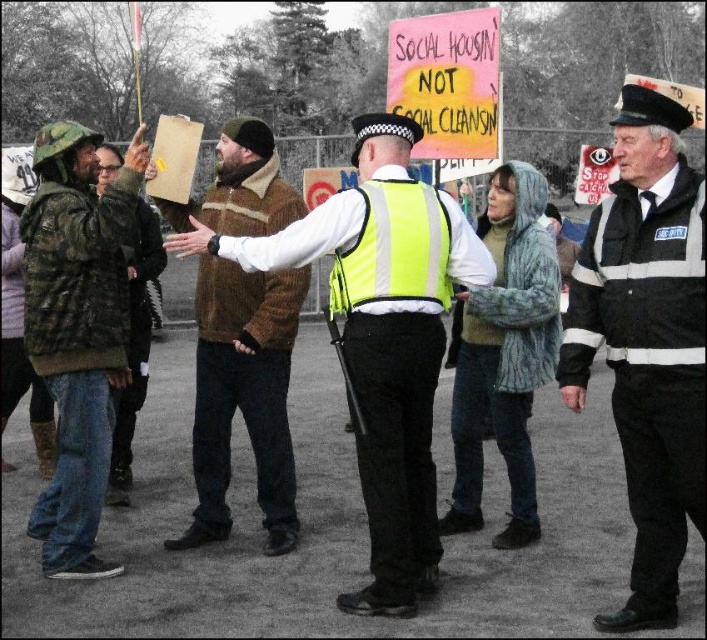
You are a photographer standing near the camera. You want to take a photo of the black uniform at center from a distance that ensures the subject fills the frame without being too close. Given that the recommended minimum distance for such shots is 3 meters, can you take the photo from your current position?

The black uniform at center and camera are 3.64 meters apart. Since the minimum recommended distance is 3 meters, you can take the photo from your current position as the distance is sufficient.

You are a photographer trying to capture a clear shot of both the camouflage fabric jacket at left and the brown fuzzy jacket at center. Based on their positions, which jacket is closer to the camera?

The camouflage fabric jacket at left is closer to the camera because it is in front of the brown fuzzy jacket at center.